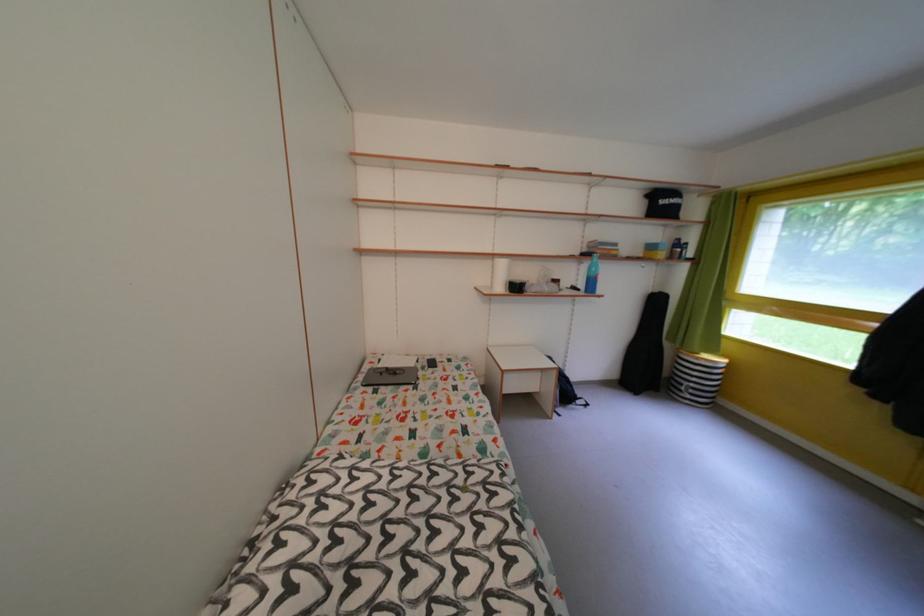
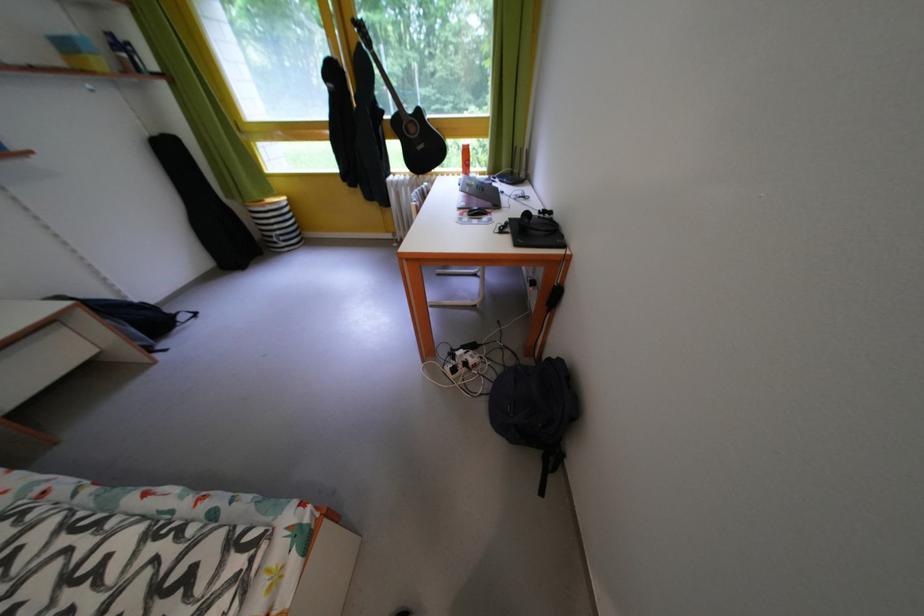
Locate, in the second image, the point that corresponds to pixel 511 448 in the first image.

(23, 485)